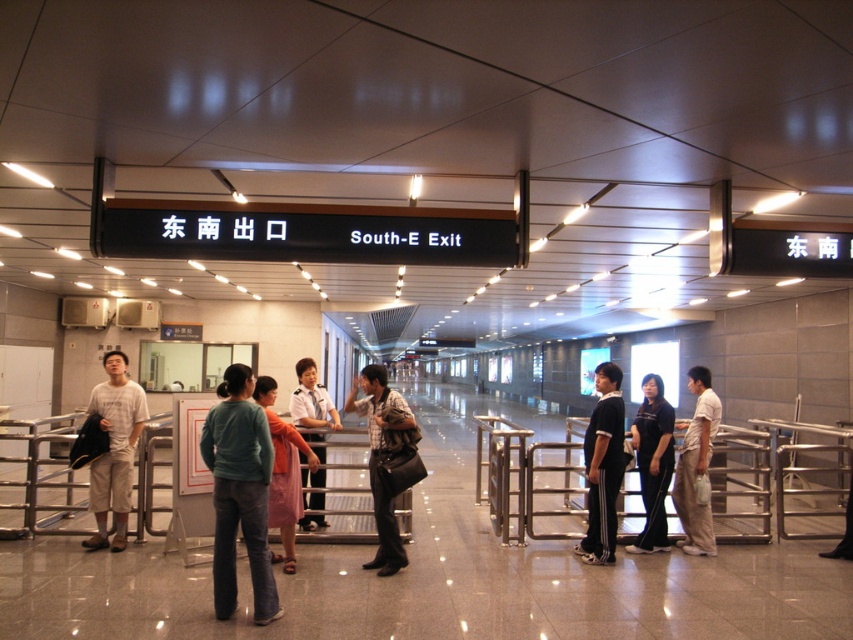
Is light beige shorts at center smaller than light brown cotton pants at center?

Incorrect, light beige shorts at center is not smaller in size than light brown cotton pants at center.

Is light beige shorts at center positioned before light brown cotton pants at center?

No, light beige shorts at center is further to the viewer.

Describe the element at coordinates (114, 449) in the screenshot. The width and height of the screenshot is (853, 640). I see `light beige shorts at center` at that location.

You are a GUI agent. You are given a task and a screenshot of the screen. Output one action in this format:
    pyautogui.click(x=<x>, y=<y>)
    Task: Click on the light beige shorts at center
    Image resolution: width=853 pixels, height=640 pixels.
    Given the screenshot: What is the action you would take?
    pyautogui.click(x=114, y=449)

Is the position of denim jeans at center less distant than that of black athletic wear at center?

That is True.

Between point (252, 552) and point (605, 388), which one is positioned behind?

The point (605, 388) is more distant.

Locate an element on the screen. denim jeans at center is located at coordinates (239, 493).

Does plaid shirt at center have a greater height compared to light brown cotton pants at center?

Yes, plaid shirt at center is taller than light brown cotton pants at center.

Does plaid shirt at center have a smaller size compared to light brown cotton pants at center?

No.

Locate an element on the screen. The height and width of the screenshot is (640, 853). plaid shirt at center is located at coordinates (383, 458).

Where is `plaid shirt at center`? This screenshot has width=853, height=640. plaid shirt at center is located at coordinates (383, 458).